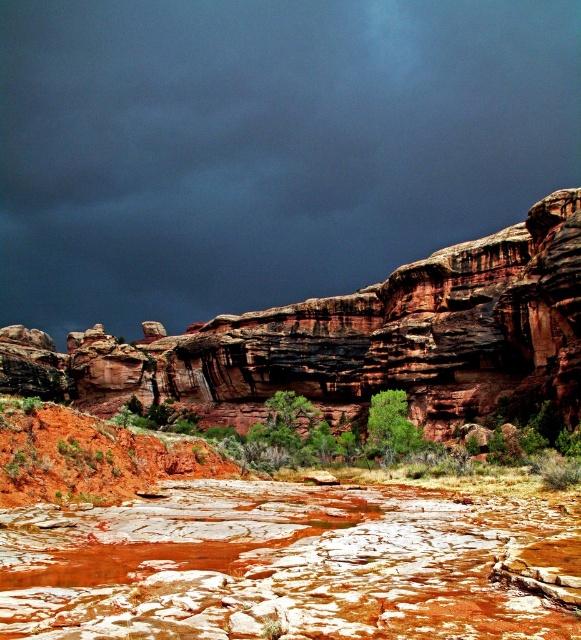
Question: Which point is closer to the camera taking this photo?

Choices:
 (A) (322, 333)
 (B) (404, 566)

Answer: (B)

Question: Can you confirm if dark gray cloud at upper center is positioned below rustic sandstone cliff at center?

Choices:
 (A) yes
 (B) no

Answer: (B)

Question: Which of these objects is positioned closest to the dark gray cloud at upper center?

Choices:
 (A) rustic stone riverbed at center
 (B) rustic sandstone cliff at center

Answer: (B)

Question: Is dark gray cloud at upper center bigger than rustic sandstone cliff at center?

Choices:
 (A) no
 (B) yes

Answer: (B)

Question: Based on their relative distances, which object is nearer to the rustic stone riverbed at center?

Choices:
 (A) dark gray cloud at upper center
 (B) rustic sandstone cliff at center

Answer: (B)

Question: Is dark gray cloud at upper center smaller than rustic stone riverbed at center?

Choices:
 (A) yes
 (B) no

Answer: (B)